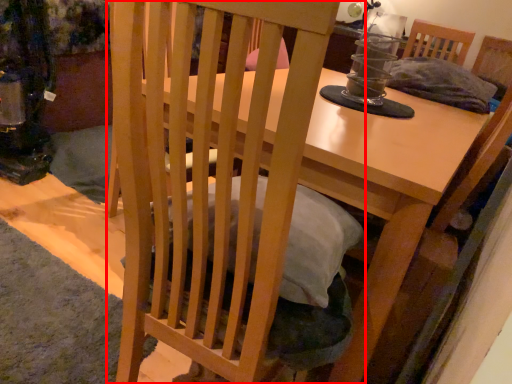
Question: From the image's perspective, where is chair (annotated by the red box) located relative to table?

Choices:
 (A) below
 (B) above

Answer: (A)